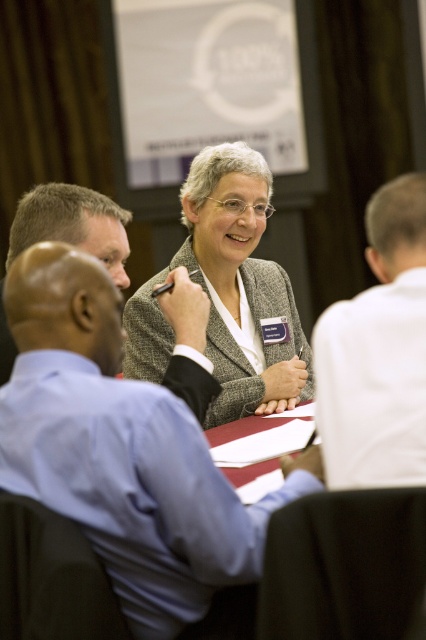
Question: Which object appears closest to the camera in this image?

Choices:
 (A) blue shirt at left
 (B) blue shirt at center

Answer: (B)

Question: Which of the following is the farthest from the observer?

Choices:
 (A) (271, 404)
 (B) (373, 449)
 (C) (106, 396)
 (D) (126, 288)

Answer: (A)

Question: Is blue shirt at center to the right of blue shirt at left from the viewer's perspective?

Choices:
 (A) yes
 (B) no

Answer: (A)

Question: Is blue shirt at center in front of blue shirt at left?

Choices:
 (A) yes
 (B) no

Answer: (A)

Question: Which object is positioned closest to the textured gray blazer at center?

Choices:
 (A) white shirt at right
 (B) blue shirt at center

Answer: (A)

Question: Does textured gray blazer at center appear under white shirt at right?

Choices:
 (A) no
 (B) yes

Answer: (A)